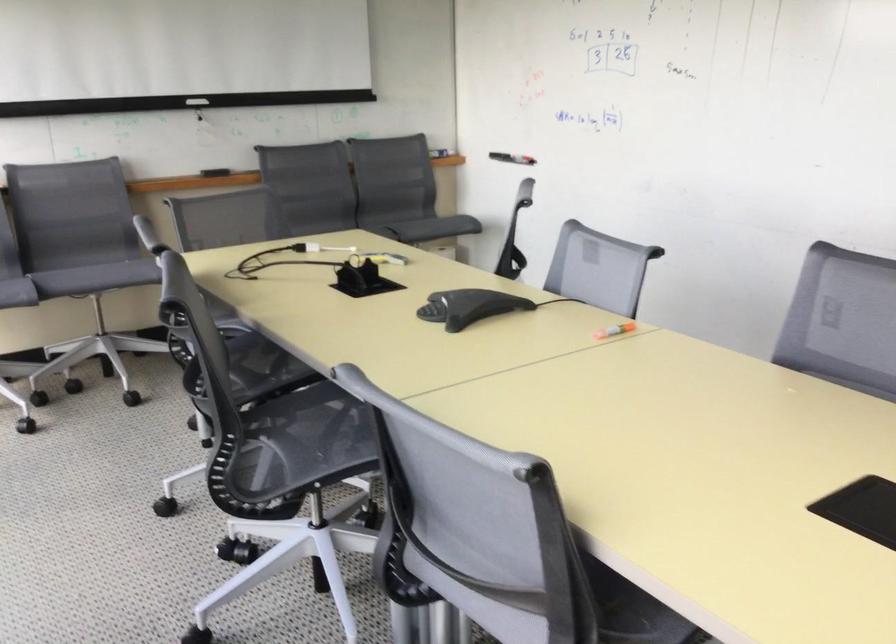
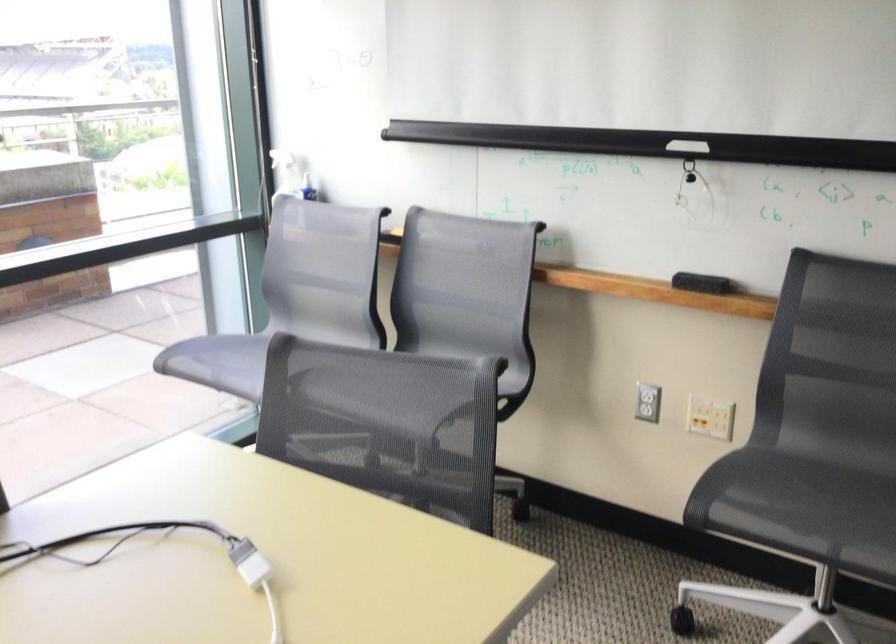
Locate, in the second image, the point that corresponds to (x=194, y=96) in the first image.

(687, 146)